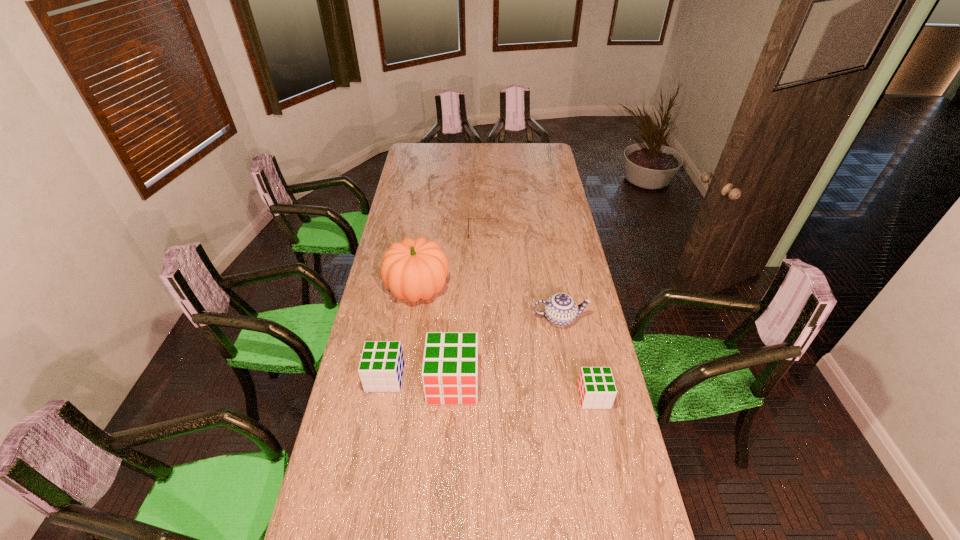
This screenshot has height=540, width=960. Identify the location of chinaware located in the right edge section of the desktop. (560, 309).

In the image, there is a desktop. Identify the location of free space at the far edge. (462, 160).

Where is `free space at the near edge of the desktop`? The height and width of the screenshot is (540, 960). free space at the near edge of the desktop is located at coordinates (415, 508).

This screenshot has height=540, width=960. Find the location of `free space at the left edge`. free space at the left edge is located at coordinates (402, 166).

Locate an element on the screen. The image size is (960, 540). free space at the right edge of the desktop is located at coordinates tap(542, 166).

Where is `vacant region at the far right corner of the desktop`? vacant region at the far right corner of the desktop is located at coordinates (530, 160).

Locate an element on the screen. The width and height of the screenshot is (960, 540). vacant area that lies between the tallest object and the sunglasses is located at coordinates (451, 261).

Identify the location of free space between the sunglasses and the tallest object. (451, 261).

Find the location of a particular element. free point between the farthest object and the second tallest object is located at coordinates [468, 308].

At what (x,y) coordinates should I click in order to perform the action: click on free space that is in between the sunglasses and the tallest object. Please return your answer as a coordinate pair (x, y). Looking at the image, I should click on (451, 261).